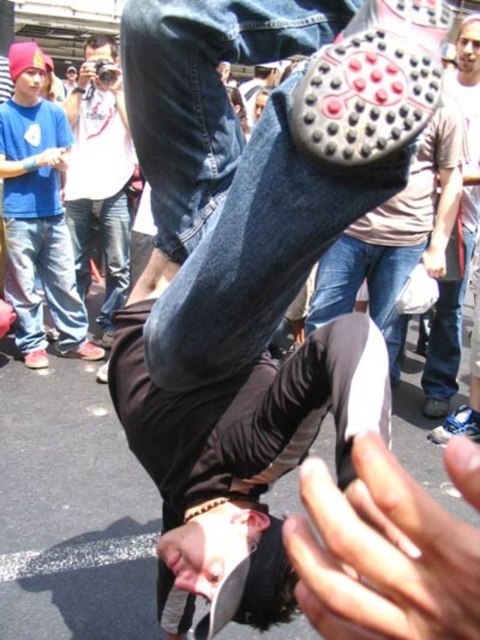
Question: Is matte blue jeans at upper left closer to the viewer compared to matte gray shoe at upper center?

Choices:
 (A) no
 (B) yes

Answer: (A)

Question: Which point is farther to the camera?

Choices:
 (A) (326, 157)
 (B) (66, 298)

Answer: (B)

Question: Among these points, which one is nearest to the camera?

Choices:
 (A) (465, 90)
 (B) (2, 186)
 (C) (415, 134)
 (D) (116, 202)

Answer: (C)

Question: Is rubber textured sole at center above matte blue jeans at upper left?

Choices:
 (A) no
 (B) yes

Answer: (A)

Question: Can you confirm if matte blue jeans at upper left is positioned to the right of white cotton t-shirt at upper left?

Choices:
 (A) yes
 (B) no

Answer: (B)

Question: Which point is farther to the camera?

Choices:
 (A) (423, 10)
 (B) (10, 172)
 (C) (475, 45)
 (D) (117, 129)

Answer: (D)